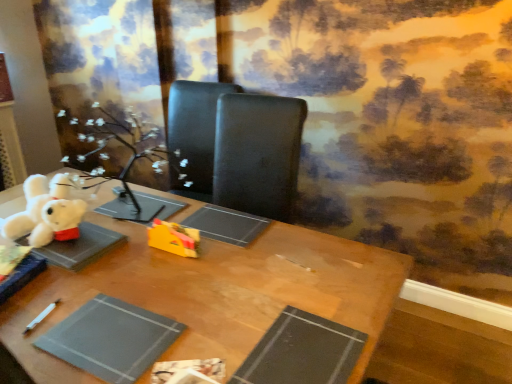
This screenshot has height=384, width=512. Find the location of `free spot above gray matte paper at lower left, which appears as the first paperback book when viewed from the left (from a real-world perspective)`. free spot above gray matte paper at lower left, which appears as the first paperback book when viewed from the left (from a real-world perspective) is located at coordinates (95, 332).